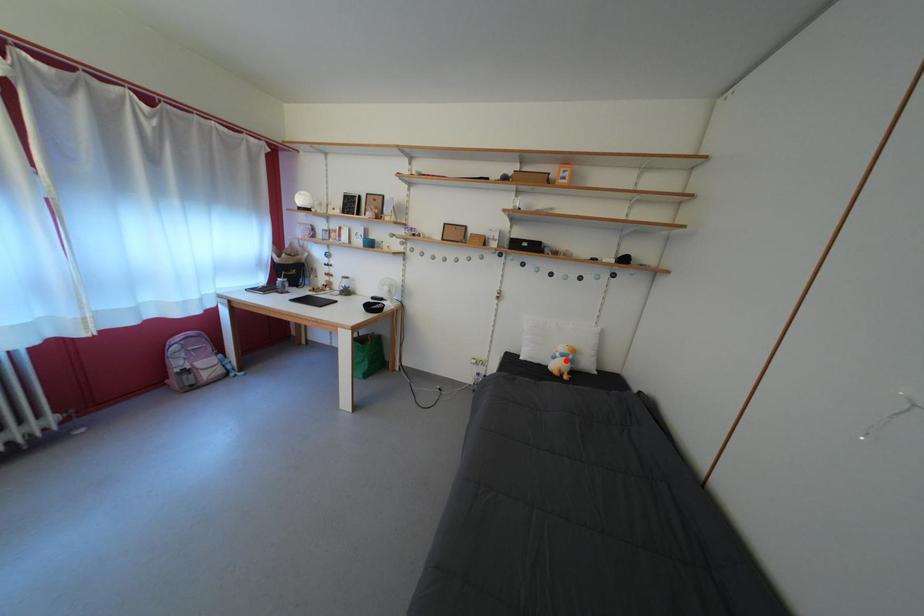
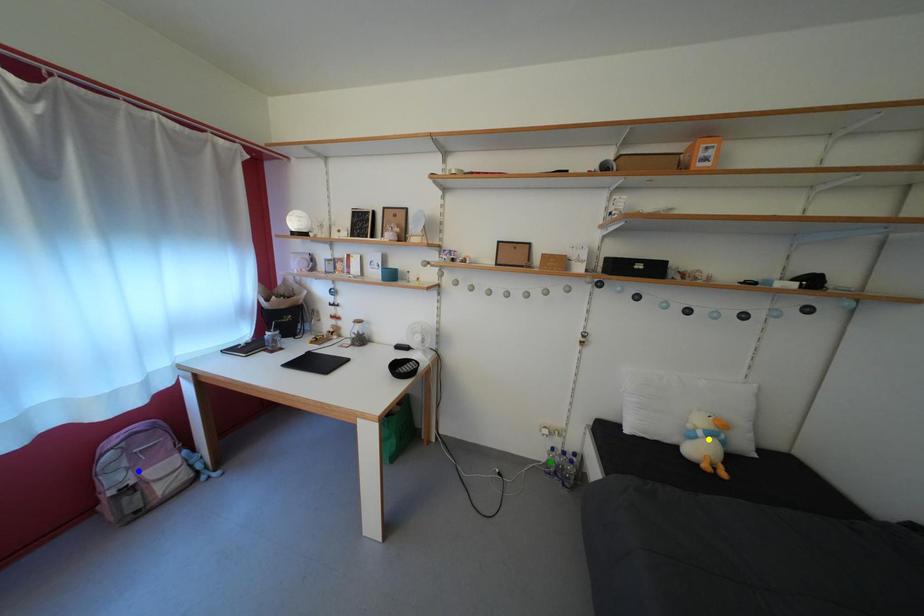
Question: I am providing you with two images of the same scene from different viewpoints. A red point is marked on the first image. You are given multiple points on the second image. Which point in image 2 is actually the same real-world point as the red point in image 1?

Choices:
 (A) yellow point
 (B) green point
 (C) blue point

Answer: (A)